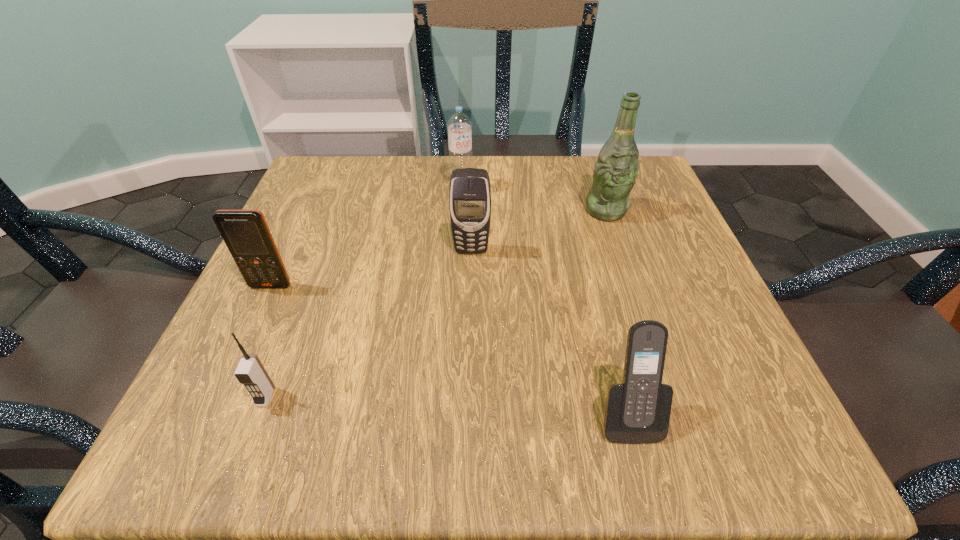
Find the location of `empty space between the leftmost object and the farthest cellular telephone`. empty space between the leftmost object and the farthest cellular telephone is located at coordinates (371, 268).

I want to click on vacant space in between the fifth object from right to left and the leftmost object, so click(268, 341).

At what (x,y) coordinates should I click in order to perform the action: click on free space that is in between the third farthest object and the second farthest object. Please return your answer as a coordinate pair (x, y). Image resolution: width=960 pixels, height=540 pixels. Looking at the image, I should click on (539, 230).

You are a GUI agent. You are given a task and a screenshot of the screen. Output one action in this format:
    pyautogui.click(x=<x>, y=<y>)
    Task: Click on the free area in between the water bottle and the rightmost cellular telephone
    The width and height of the screenshot is (960, 540).
    Given the screenshot: What is the action you would take?
    pyautogui.click(x=544, y=301)

This screenshot has width=960, height=540. In order to click on free space between the tallest object and the leftmost cellular telephone in this screenshot , I will do point(438,248).

Locate an element on the screen. The height and width of the screenshot is (540, 960). free spot between the shortest object and the farthest object is located at coordinates (364, 292).

At what (x,y) coordinates should I click in order to perform the action: click on free space between the fourth farthest object and the shortest cellular telephone. Please return your answer as a coordinate pair (x, y). The image size is (960, 540). Looking at the image, I should click on (268, 341).

Where is `vacant area between the tallest object and the second cellular telephone from left to right`? vacant area between the tallest object and the second cellular telephone from left to right is located at coordinates (x=436, y=303).

Locate an element on the screen. Image resolution: width=960 pixels, height=540 pixels. unoccupied position between the rightmost cellular telephone and the third cellular telephone from right to left is located at coordinates (446, 406).

At what (x,y) coordinates should I click in order to perform the action: click on the fourth closest object to the rightmost cellular telephone. Please return your answer as a coordinate pair (x, y). The width and height of the screenshot is (960, 540). Looking at the image, I should click on (459, 125).